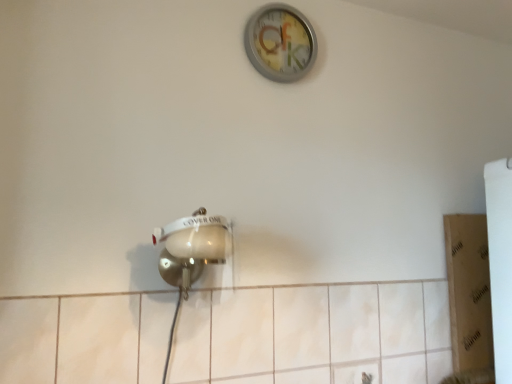
The width and height of the screenshot is (512, 384). What do you see at coordinates (280, 42) in the screenshot?
I see `metallic silver wall clock at upper center` at bounding box center [280, 42].

Find the location of a particular element. The image size is (512, 384). metallic silver wall clock at upper center is located at coordinates (280, 42).

Identify the location of metallic silver wall clock at upper center. The image size is (512, 384). (280, 42).